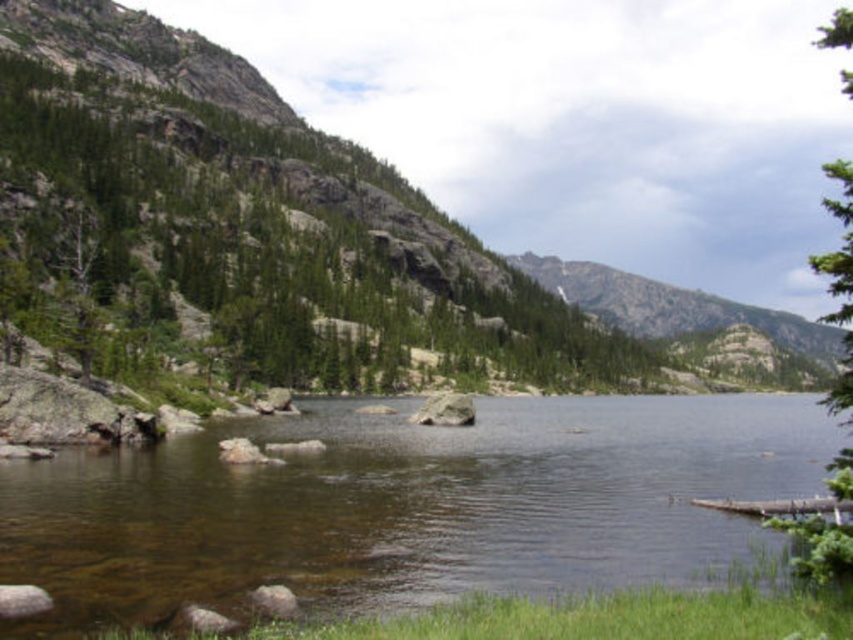
Question: Does green textured tree at right come behind smooth gray rock at center?

Choices:
 (A) yes
 (B) no

Answer: (B)

Question: Which is nearer to the clear water at center?

Choices:
 (A) rocky gray mountain at center
 (B) smooth gray rock at center
 (C) green textured tree at right

Answer: (B)

Question: Which of the following is the farthest from the observer?

Choices:
 (A) (827, 397)
 (B) (372, 401)
 (C) (753, 310)
 (D) (448, 424)

Answer: (C)

Question: Which point is closer to the camera?

Choices:
 (A) (589, 268)
 (B) (33, 476)
 (C) (838, 212)

Answer: (C)

Question: Observing the image, what is the correct spatial positioning of clear water at center in reference to rocky gray mountain at center?

Choices:
 (A) left
 (B) right

Answer: (A)

Question: Can you confirm if green textured tree at right is positioned below smooth gray rock at center?

Choices:
 (A) no
 (B) yes

Answer: (A)